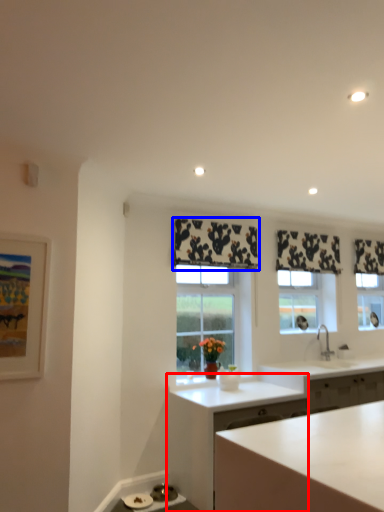
Question: Among these objects, which one is nearest to the camera, cabinetry (highlighted by a red box) or curtain (highlighted by a blue box)?

Choices:
 (A) cabinetry
 (B) curtain

Answer: (A)